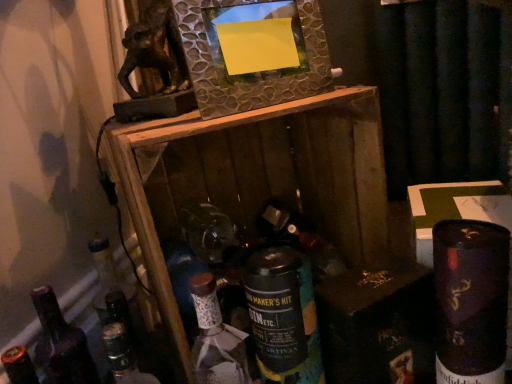
At what (x,y) coordinates should I click in order to perform the action: click on black matte can at center, the second bottle from the right. Please return your answer as a coordinate pair (x, y). Looking at the image, I should click on [283, 316].

This screenshot has width=512, height=384. What do you see at coordinates (303, 240) in the screenshot?
I see `matte glass wine bottle at center` at bounding box center [303, 240].

Where is `white ceramic bottle at center, which ranks as the second bottle in left-to-right order`? The image size is (512, 384). white ceramic bottle at center, which ranks as the second bottle in left-to-right order is located at coordinates (216, 339).

The image size is (512, 384). What do you see at coordinates (471, 300) in the screenshot? I see `shiny dark blue can at lower right, which is the first bottle in right-to-left order` at bounding box center [471, 300].

Describe the element at coordinates (249, 84) in the screenshot. This screenshot has height=384, width=512. I see `metallic textured frame at upper center` at that location.

At what (x,y) coordinates should I click in order to perform the action: click on dark brown glass bottle at lower left, positioned as the 4th bottle in right-to-left order. Please return your answer as a coordinate pair (x, y). The width and height of the screenshot is (512, 384). Looking at the image, I should click on (61, 344).

Is black matte can at center, the second bottle from the right, facing away from white ceramic bottle at center, acting as the 3th bottle starting from the right?

That's not correct — black matte can at center, the second bottle from the right, is not looking away from white ceramic bottle at center, acting as the 3th bottle starting from the right.

From the image's perspective, between black matte can at center, the second bottle from the right, and white ceramic bottle at center, acting as the 3th bottle starting from the right, who is located below?

From the image's view, white ceramic bottle at center, acting as the 3th bottle starting from the right, is below.

Is black matte can at center, the third bottle when ordered from left to right, to the left or to the right of white ceramic bottle at center, which ranks as the second bottle in left-to-right order, in the image?

From the image, it's evident that black matte can at center, the third bottle when ordered from left to right, is to the right of white ceramic bottle at center, which ranks as the second bottle in left-to-right order.

How much distance is there between black matte can at center, the second bottle from the right, and white ceramic bottle at center, which ranks as the second bottle in left-to-right order?

A distance of 2.79 inches exists between black matte can at center, the second bottle from the right, and white ceramic bottle at center, which ranks as the second bottle in left-to-right order.

From a real-world perspective, is matte glass wine bottle at center physically below white ceramic bottle at center, acting as the 3th bottle starting from the right?

No, from a real-world perspective, matte glass wine bottle at center is not below white ceramic bottle at center, acting as the 3th bottle starting from the right.

Is matte glass wine bottle at center bigger than white ceramic bottle at center, which ranks as the second bottle in left-to-right order?

No, matte glass wine bottle at center is not bigger than white ceramic bottle at center, which ranks as the second bottle in left-to-right order.

Is matte glass wine bottle at center not near white ceramic bottle at center, acting as the 3th bottle starting from the right?

No, matte glass wine bottle at center is not far away from white ceramic bottle at center, acting as the 3th bottle starting from the right.

Is point (313, 234) closer or farther from the camera than point (222, 379)?

Point (313, 234) is farther from the camera than point (222, 379).

Locate an element on the screen. This screenshot has width=512, height=384. wine bottle on the right of the dark brown glass bottle at lower left, the 1th bottle when ordered from left to right is located at coordinates (303, 240).

Is dark brown glass bottle at lower left, positioned as the 4th bottle in right-to-left order, bigger than matte glass wine bottle at center?

Yes.

Is matte glass wine bottle at center completely or partially inside dark brown glass bottle at lower left, positioned as the 4th bottle in right-to-left order?

No, matte glass wine bottle at center is not a part of dark brown glass bottle at lower left, positioned as the 4th bottle in right-to-left order.

From the image's perspective, which is above, dark brown glass bottle at lower left, the 1th bottle when ordered from left to right, or matte glass wine bottle at center?

From the image's view, matte glass wine bottle at center is above.

Which object is positioned more to the right, metallic textured frame at upper center or white ceramic bottle at center, which ranks as the second bottle in left-to-right order?

metallic textured frame at upper center is more to the right.

From the image's perspective, is metallic textured frame at upper center located beneath white ceramic bottle at center, acting as the 3th bottle starting from the right?

Actually, metallic textured frame at upper center appears above white ceramic bottle at center, acting as the 3th bottle starting from the right, in the image.

Is metallic textured frame at upper center oriented away from white ceramic bottle at center, acting as the 3th bottle starting from the right?

No.

Find the location of a particular element. The width and height of the screenshot is (512, 384). bottle that is the 1st object directly below the metallic textured frame at upper center (from a real-world perspective) is located at coordinates pyautogui.click(x=216, y=339).

From a real-world perspective, which is physically above, shiny dark blue can at lower right, marked as the 4th bottle in a left-to-right arrangement, or dark brown glass bottle at lower left, positioned as the 4th bottle in right-to-left order?

shiny dark blue can at lower right, marked as the 4th bottle in a left-to-right arrangement.

How much distance is there between shiny dark blue can at lower right, which is the first bottle in right-to-left order, and dark brown glass bottle at lower left, the 1th bottle when ordered from left to right?

shiny dark blue can at lower right, which is the first bottle in right-to-left order, and dark brown glass bottle at lower left, the 1th bottle when ordered from left to right, are 58.03 centimeters apart from each other.

Is shiny dark blue can at lower right, marked as the 4th bottle in a left-to-right arrangement, oriented towards dark brown glass bottle at lower left, positioned as the 4th bottle in right-to-left order?

No.

From the picture: Would you say shiny dark blue can at lower right, which is the first bottle in right-to-left order, is a long distance from dark brown glass bottle at lower left, positioned as the 4th bottle in right-to-left order?

Actually, shiny dark blue can at lower right, which is the first bottle in right-to-left order, and dark brown glass bottle at lower left, positioned as the 4th bottle in right-to-left order, are a little close together.

Which is behind, black matte can at center, the third bottle when ordered from left to right, or dark brown glass bottle at lower left, the 1th bottle when ordered from left to right?

dark brown glass bottle at lower left, the 1th bottle when ordered from left to right, is further away from the camera.

Does black matte can at center, the third bottle when ordered from left to right, have a lesser width compared to dark brown glass bottle at lower left, the 1th bottle when ordered from left to right?

Incorrect, the width of black matte can at center, the third bottle when ordered from left to right, is not less than that of dark brown glass bottle at lower left, the 1th bottle when ordered from left to right.

Does point (275, 251) lie in front of point (71, 354)?

Yes, point (275, 251) is in front of point (71, 354).

How far apart are black matte can at center, the second bottle from the right, and dark brown glass bottle at lower left, positioned as the 4th bottle in right-to-left order?

black matte can at center, the second bottle from the right, is 12.77 inches away from dark brown glass bottle at lower left, positioned as the 4th bottle in right-to-left order.

Which point is more forward, (439, 285) or (253, 1)?

The point (439, 285) is in front.

From a real-world perspective, who is located lower, shiny dark blue can at lower right, which is the first bottle in right-to-left order, or metallic textured frame at upper center?

From a 3D spatial view, shiny dark blue can at lower right, which is the first bottle in right-to-left order, is below.

Is shiny dark blue can at lower right, which is the first bottle in right-to-left order, facing away from metallic textured frame at upper center?

No, shiny dark blue can at lower right, which is the first bottle in right-to-left order,'s orientation is not away from metallic textured frame at upper center.

There is a white ceramic bottle at center, which ranks as the second bottle in left-to-right order. Where is `the 2nd bottle below it (from a real-world perspective)`? the 2nd bottle below it (from a real-world perspective) is located at coordinates (283, 316).

Locate an element on the screen. bottle that is the 2nd object to the left of the matte glass wine bottle at center, starting at the anchor is located at coordinates (216, 339).

Looking at the image, which one is located further to black matte can at center, the second bottle from the right, dark brown glass bottle at lower left, positioned as the 4th bottle in right-to-left order, or matte glass wine bottle at center?

dark brown glass bottle at lower left, positioned as the 4th bottle in right-to-left order.

Estimate the real-world distances between objects in this image. Which object is further from black matte can at center, the second bottle from the right, metallic textured frame at upper center or matte glass wine bottle at center?

Among the two, metallic textured frame at upper center is located further to black matte can at center, the second bottle from the right.

From the picture: Based on their spatial positions, is white ceramic bottle at center, which ranks as the second bottle in left-to-right order, or metallic textured frame at upper center further from dark brown glass bottle at lower left, positioned as the 4th bottle in right-to-left order?

metallic textured frame at upper center is further to dark brown glass bottle at lower left, positioned as the 4th bottle in right-to-left order.

Which object lies nearer to the anchor point matte glass wine bottle at center, shiny dark blue can at lower right, which is the first bottle in right-to-left order, or black matte can at center, the third bottle when ordered from left to right?

black matte can at center, the third bottle when ordered from left to right, lies closer to matte glass wine bottle at center than the other object.

Looking at the image, which one is located closer to matte glass wine bottle at center, white ceramic bottle at center, acting as the 3th bottle starting from the right, or black matte can at center, the second bottle from the right?

Among the two, black matte can at center, the second bottle from the right, is located nearer to matte glass wine bottle at center.

Considering their positions, is dark brown glass bottle at lower left, positioned as the 4th bottle in right-to-left order, positioned closer to matte glass wine bottle at center than black matte can at center, the third bottle when ordered from left to right?

black matte can at center, the third bottle when ordered from left to right, is closer to matte glass wine bottle at center.

Considering their positions, is metallic textured frame at upper center positioned closer to white ceramic bottle at center, acting as the 3th bottle starting from the right, than matte glass wine bottle at center?

matte glass wine bottle at center lies closer to white ceramic bottle at center, acting as the 3th bottle starting from the right, than the other object.

Which object lies nearer to the anchor point metallic textured frame at upper center, white ceramic bottle at center, which ranks as the second bottle in left-to-right order, or shiny dark blue can at lower right, which is the first bottle in right-to-left order?

Among the two, white ceramic bottle at center, which ranks as the second bottle in left-to-right order, is located nearer to metallic textured frame at upper center.

The height and width of the screenshot is (384, 512). What are the coordinates of `wine bottle that lies between metallic textured frame at upper center and black matte can at center, the second bottle from the right, from top to bottom` in the screenshot? It's located at point(303,240).

Where is `wine bottle located between white ceramic bottle at center, acting as the 3th bottle starting from the right, and shiny dark blue can at lower right, which is the first bottle in right-to-left order, in the left-right direction`? wine bottle located between white ceramic bottle at center, acting as the 3th bottle starting from the right, and shiny dark blue can at lower right, which is the first bottle in right-to-left order, in the left-right direction is located at coordinates (303, 240).

Where is `bottle between metallic textured frame at upper center and black matte can at center, the third bottle when ordered from left to right, vertically`? Image resolution: width=512 pixels, height=384 pixels. bottle between metallic textured frame at upper center and black matte can at center, the third bottle when ordered from left to right, vertically is located at coordinates tap(471, 300).

Locate an element on the screen. This screenshot has height=384, width=512. wine bottle between metallic textured frame at upper center and shiny dark blue can at lower right, which is the first bottle in right-to-left order, in the vertical direction is located at coordinates (303, 240).